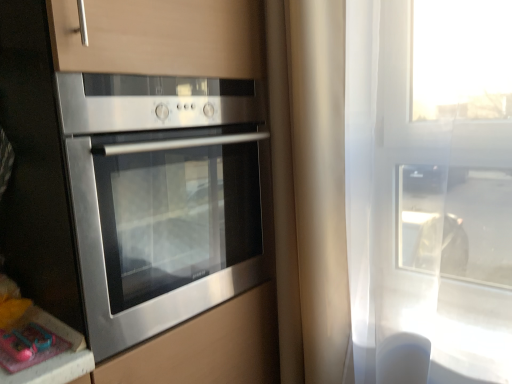
The height and width of the screenshot is (384, 512). Find the location of `pink plastic toy at lower left`. pink plastic toy at lower left is located at coordinates (x=54, y=357).

Image resolution: width=512 pixels, height=384 pixels. What do you see at coordinates (54, 357) in the screenshot?
I see `pink plastic toy at lower left` at bounding box center [54, 357].

I want to click on stainless steel oven at left, so click(x=161, y=198).

Describe the element at coordinates (161, 198) in the screenshot. I see `stainless steel oven at left` at that location.

Measure the distance between point (234, 294) and camera.

Point (234, 294) and camera are 4.00 feet apart from each other.

This screenshot has height=384, width=512. In order to click on pink plastic toy at lower left in this screenshot , I will do `click(54, 357)`.

Considering the positions of objects pink plastic toy at lower left and stainless steel oven at left in the image provided, who is more to the left, pink plastic toy at lower left or stainless steel oven at left?

Positioned to the left is pink plastic toy at lower left.

Is pink plastic toy at lower left in front of or behind stainless steel oven at left in the image?

Clearly, pink plastic toy at lower left is behind stainless steel oven at left.

Does point (50, 371) lie in front of point (159, 316)?

Yes, point (50, 371) is in front of point (159, 316).

Based on the photo, from the image's perspective, which object appears higher, pink plastic toy at lower left or stainless steel oven at left?

stainless steel oven at left appears higher in the image.

Looking at this image, from a real-world perspective, relative to stainless steel oven at left, is pink plastic toy at lower left vertically above or below?

In terms of real-world spatial position, pink plastic toy at lower left is below stainless steel oven at left.

Which of these two, pink plastic toy at lower left or stainless steel oven at left, is thinner?

pink plastic toy at lower left is thinner.

Is pink plastic toy at lower left taller or shorter than stainless steel oven at left?

In the image, pink plastic toy at lower left appears to be shorter than stainless steel oven at left.

Considering the sizes of objects pink plastic toy at lower left and stainless steel oven at left in the image provided, who is bigger, pink plastic toy at lower left or stainless steel oven at left?

stainless steel oven at left.

Consider the image. Is pink plastic toy at lower left situated inside stainless steel oven at left or outside?

pink plastic toy at lower left is not enclosed by stainless steel oven at left.

Does pink plastic toy at lower left touch stainless steel oven at left?

pink plastic toy at lower left and stainless steel oven at left are clearly separated.

Is pink plastic toy at lower left oriented away from stainless steel oven at left?

No, pink plastic toy at lower left is not facing away from stainless steel oven at left.

What's the angular difference between pink plastic toy at lower left and stainless steel oven at left's facing directions?

7.49e-05 degrees.

How much distance is there between pink plastic toy at lower left and stainless steel oven at left?

pink plastic toy at lower left and stainless steel oven at left are 36.50 centimeters apart from each other.

I want to click on counter top that is under the stainless steel oven at left (from a real-world perspective), so pos(54,357).

Can you confirm if stainless steel oven at left is positioned to the right of pink plastic toy at lower left?

Yes.

Is stainless steel oven at left in front of pink plastic toy at lower left?

Yes, it is.

Is point (244, 192) positioned in front of point (74, 332)?

No, it is behind (74, 332).

From the image's perspective, is stainless steel oven at left over pink plastic toy at lower left?

Indeed, from the image's perspective, stainless steel oven at left is shown above pink plastic toy at lower left.

From a real-world perspective, is stainless steel oven at left below pink plastic toy at lower left?

No, from a real-world perspective, stainless steel oven at left is not below pink plastic toy at lower left.

Looking at this image, is stainless steel oven at left thinner than pink plastic toy at lower left?

No, stainless steel oven at left is not thinner than pink plastic toy at lower left.

Can you confirm if stainless steel oven at left is shorter than pink plastic toy at lower left?

Incorrect, the height of stainless steel oven at left does not fall short of that of pink plastic toy at lower left.

From the picture: Considering the relative sizes of stainless steel oven at left and pink plastic toy at lower left in the image provided, is stainless steel oven at left smaller than pink plastic toy at lower left?

No.

Is pink plastic toy at lower left located within stainless steel oven at left?

Actually, pink plastic toy at lower left is outside stainless steel oven at left.

Is there a large distance between stainless steel oven at left and pink plastic toy at lower left?

No, stainless steel oven at left is not far away from pink plastic toy at lower left.

Is stainless steel oven at left oriented towards pink plastic toy at lower left?

No.

How different are the orientations of stainless steel oven at left and pink plastic toy at lower left in degrees?

The facing directions of stainless steel oven at left and pink plastic toy at lower left are 7.49e-05 degrees apart.

Locate an element on the screen. The image size is (512, 384). oven in front of the pink plastic toy at lower left is located at coordinates point(161,198).

Image resolution: width=512 pixels, height=384 pixels. I want to click on oven that is in front of the pink plastic toy at lower left, so click(x=161, y=198).

Find the location of a particular element. counter top located behind the stainless steel oven at left is located at coordinates (54, 357).